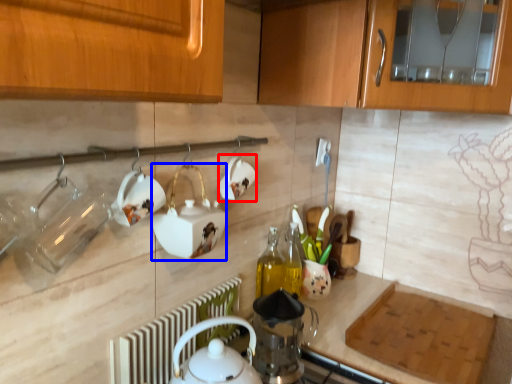
Question: Among these objects, which one is nearest to the camera, tableware (highlighted by a red box) or appliance (highlighted by a blue box)?

Choices:
 (A) tableware
 (B) appliance

Answer: (B)